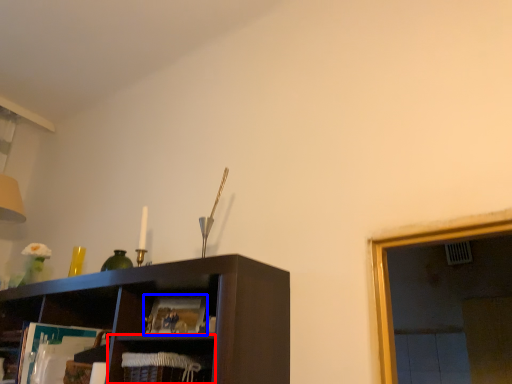
Question: Which object appears closest to the camera in this image, cabinet (highlighted by a red box) or magazine (highlighted by a blue box)?

Choices:
 (A) cabinet
 (B) magazine

Answer: (A)